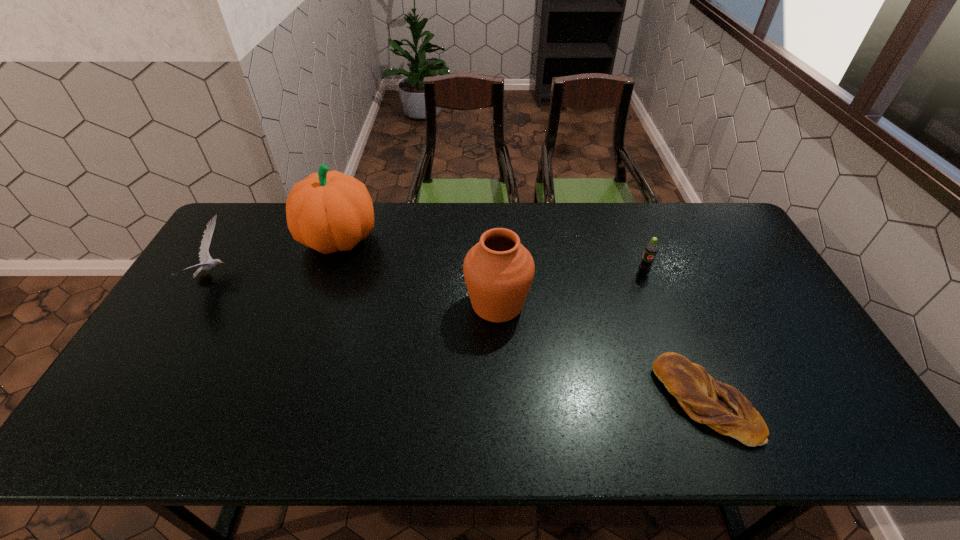
The height and width of the screenshot is (540, 960). Find the location of `vacant region that satisfies the following two spatial constraints: 1. at the tip of the beak of the gull; 2. on the back side of the nearest object`. vacant region that satisfies the following two spatial constraints: 1. at the tip of the beak of the gull; 2. on the back side of the nearest object is located at coordinates (138, 401).

Find the location of a particular element. The height and width of the screenshot is (540, 960). vacant space that satisfies the following two spatial constraints: 1. at the tip of the beak of the urn; 2. on the right side of the leftmost object is located at coordinates (197, 305).

You are a GUI agent. You are given a task and a screenshot of the screen. Output one action in this format:
    pyautogui.click(x=<x>, y=<y>)
    Task: Click on the free location that satisfies the following two spatial constraints: 1. on the front label of the soda; 2. at the tip of the beak of the gull
    
    Given the screenshot: What is the action you would take?
    pyautogui.click(x=644, y=276)

In order to click on vacant area that satisfies the following two spatial constraints: 1. at the tip of the beak of the gull; 2. on the back side of the second tallest object in this screenshot , I will do `click(197, 305)`.